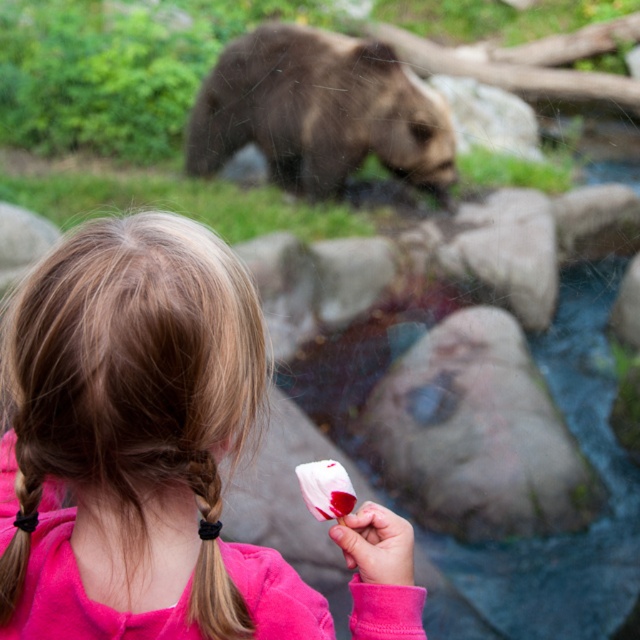
Is point (240, 323) less distant than point (301, 29)?

Yes, point (240, 323) is in front of point (301, 29).

Is pink fabric ice cream at center positioned behind brown fuzzy bear at upper center?

No.

Between point (51, 332) and point (419, 100), which one is positioned behind?

The point (419, 100) is behind.

You are a GUI agent. You are given a task and a screenshot of the screen. Output one action in this format:
    pyautogui.click(x=<x>, y=<y>)
    Task: Click on the pink fabric ice cream at center
    This screenshot has width=640, height=640.
    Given the screenshot: What is the action you would take?
    pyautogui.click(x=134, y=444)

Which is more to the right, brown fuzzy bear at upper center or black rubber band at back?

brown fuzzy bear at upper center is more to the right.

Which is more to the left, brown fuzzy bear at upper center or black rubber band at back?

black rubber band at back

Is point (212, 122) positioned after point (208, 502)?

Yes.

Where is `brown fuzzy bear at upper center`? The width and height of the screenshot is (640, 640). brown fuzzy bear at upper center is located at coordinates (320, 112).

Who is more forward, (218, 570) or (212, 524)?

Point (212, 524) is more forward.

Is point (38, 291) positioned before point (216, 483)?

That is True.

This screenshot has height=640, width=640. Identify the location of pink fabric ice cream at center. (134, 444).

Identify the location of pink fabric ice cream at center. (134, 444).